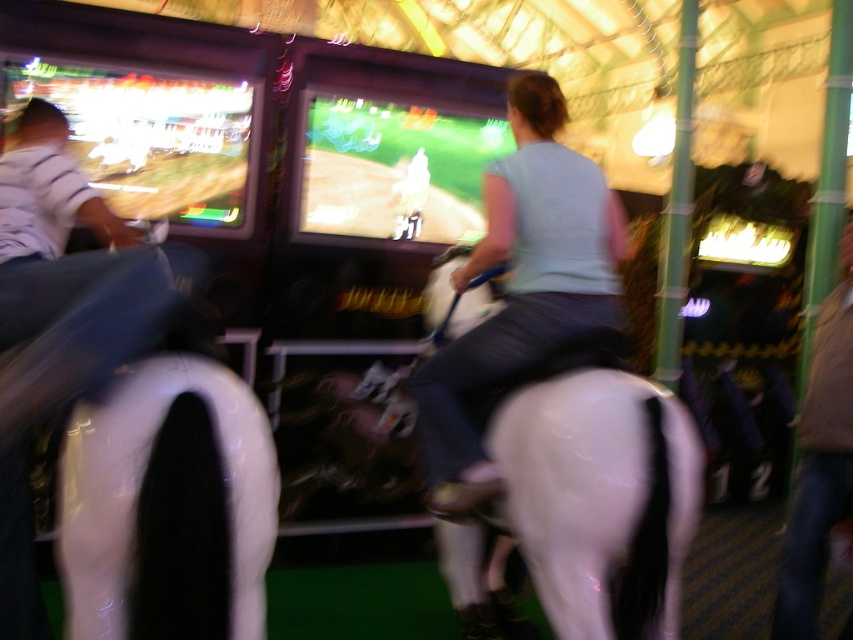
Question: Which of the following is the farthest from the observer?

Choices:
 (A) light blue fabric at center
 (B) brown leather jacket at lower right

Answer: (B)

Question: Does light blue fabric at center have a larger size compared to brown leather jacket at lower right?

Choices:
 (A) no
 (B) yes

Answer: (B)

Question: Which of the following is the farthest from the observer?

Choices:
 (A) brown leather jacket at lower right
 (B) white glossy horse at center

Answer: (A)

Question: Which point appears closest to the camera in this image?

Choices:
 (A) (x=476, y=301)
 (B) (x=845, y=284)
 (C) (x=474, y=362)

Answer: (C)

Question: Is light blue fabric at center further to the viewer compared to brown leather jacket at lower right?

Choices:
 (A) yes
 (B) no

Answer: (B)

Question: In this image, where is light blue fabric at center located relative to brown leather jacket at lower right?

Choices:
 (A) left
 (B) right

Answer: (A)